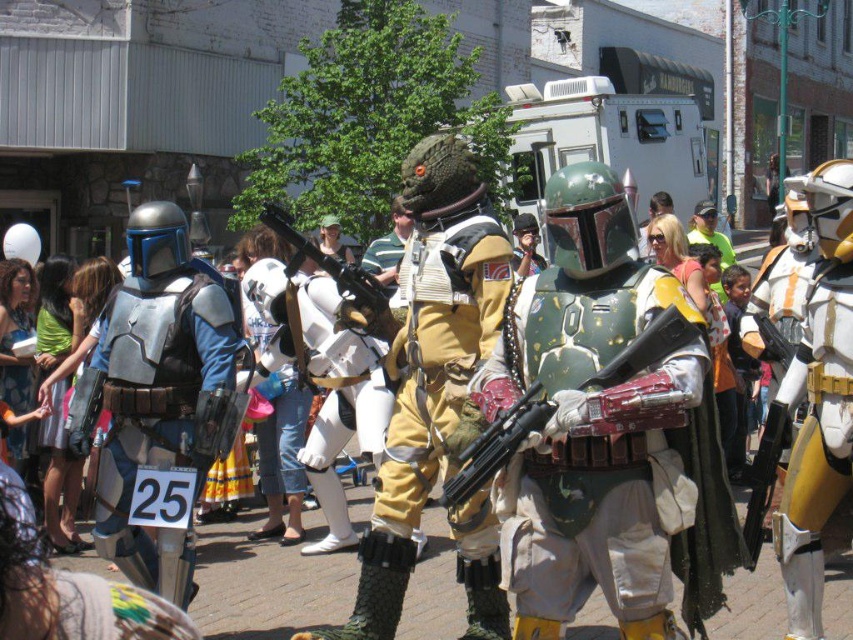
Which is more to the right, leather-like armor at center or brushed metal armor at left?

leather-like armor at center

Which is behind, point (397, 449) or point (161, 381)?

The point (397, 449) is behind.

Which is behind, point (340, 628) or point (178, 588)?

The point (178, 588) is more distant.

Find the location of a particular element. This screenshot has height=640, width=853. leather-like armor at center is located at coordinates (428, 364).

Is metallic green armor at center to the right of brushed metal helmet at left from the viewer's perspective?

Indeed, metallic green armor at center is positioned on the right side of brushed metal helmet at left.

Is point (579, 538) less distant than point (25, 330)?

That is True.

Where is `metallic green armor at center`? metallic green armor at center is located at coordinates (601, 428).

Can you confirm if metallic green armor at center is smaller than brushed metal armor at left?

Indeed, metallic green armor at center has a smaller size compared to brushed metal armor at left.

Who is shorter, metallic green armor at center or brushed metal armor at left?

Standing shorter between the two is metallic green armor at center.

Between point (618, 401) and point (148, 300), which one is positioned behind?

The point (148, 300) is more distant.

Where is `metallic green armor at center`? Image resolution: width=853 pixels, height=640 pixels. metallic green armor at center is located at coordinates (601, 428).